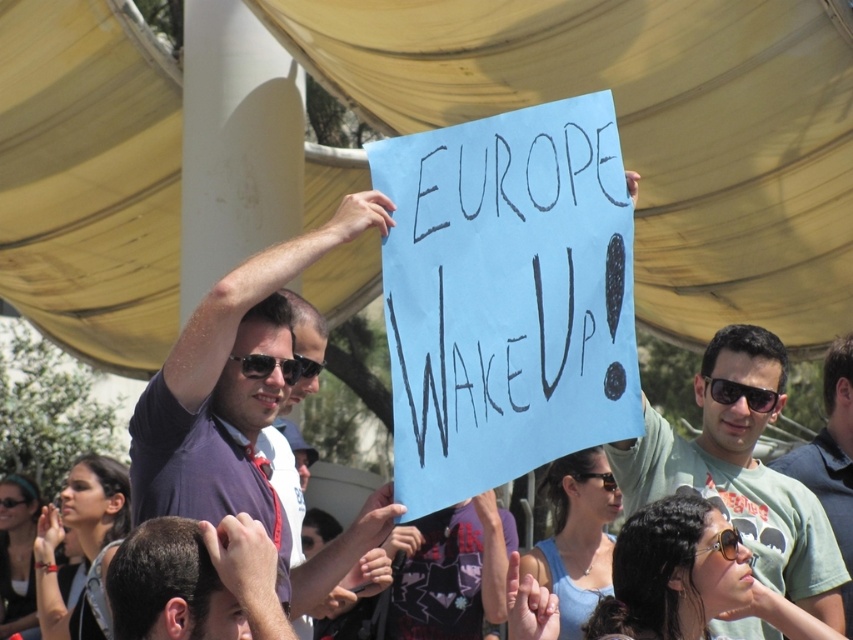
Question: Among these objects, which one is farthest from the camera?

Choices:
 (A) dark brown hair at center
 (B) black plastic goggles at upper center
 (C) sunglasses at center
 (D) green cotton shirt at center

Answer: (B)

Question: Is green cotton shirt at center bigger than black reflective sunglasses at center?

Choices:
 (A) yes
 (B) no

Answer: (A)

Question: Does sunglasses at center come in front of black plastic goggles at upper center?

Choices:
 (A) no
 (B) yes

Answer: (B)

Question: Is matte purple shirt at center wider than sunglasses at center?

Choices:
 (A) no
 (B) yes

Answer: (B)

Question: Which point is closer to the camera taking this photo?

Choices:
 (A) (712, 385)
 (B) (207, 333)

Answer: (B)

Question: Among these objects, which one is farthest from the camera?

Choices:
 (A) black plastic goggles at upper center
 (B) matte purple shirt at center

Answer: (A)